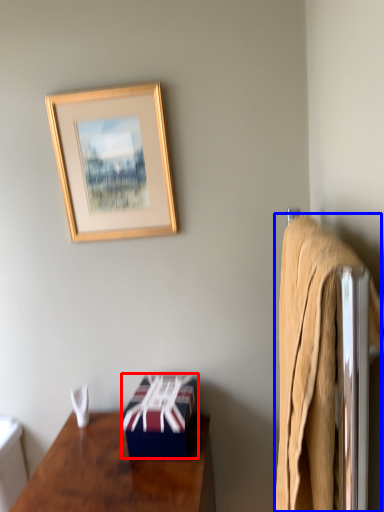
Question: Which object appears farthest to the camera in this image, box (highlighted by a red box) or bath towel (highlighted by a blue box)?

Choices:
 (A) box
 (B) bath towel

Answer: (A)